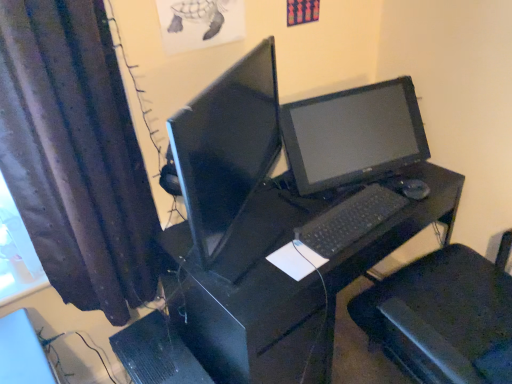
In order to click on vacant region under matte black monitor at center (from a real-world perspective) in this screenshot , I will do `click(242, 250)`.